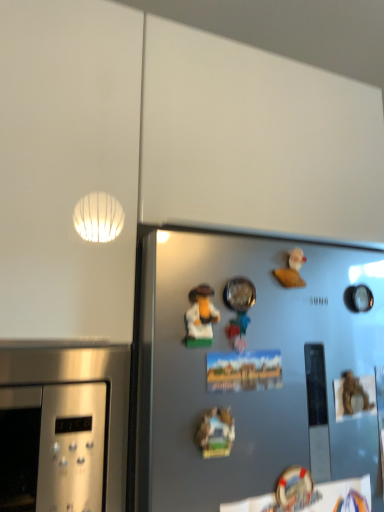
Question: Should I look upward or downward to see white matte rubber duck at upper right, which appears as the 2th toy when viewed from the left?

Choices:
 (A) down
 (B) up

Answer: (A)

Question: Which direction should I rotate to look at metallic silver bowl at center, the first toy when ordered from left to right?

Choices:
 (A) right
 (B) left

Answer: (A)

Question: Is the position of wooden miniature house at center, which is the 2th art from top to bottom, more distant than that of white matte rubber duck at upper right, the first toy viewed from the back?

Choices:
 (A) yes
 (B) no

Answer: (B)

Question: Does wooden miniature house at center, the 1th art ordered from the bottom, have a larger size compared to white matte rubber duck at upper right, positioned as the first toy in right-to-left order?

Choices:
 (A) yes
 (B) no

Answer: (A)

Question: Can you confirm if wooden miniature house at center, which is the 2th art from top to bottom, is positioned to the left of white matte rubber duck at upper right, positioned as the first toy in right-to-left order?

Choices:
 (A) yes
 (B) no

Answer: (A)

Question: Is wooden miniature house at center, which is the 2th art from top to bottom, wider than white matte rubber duck at upper right, the first toy viewed from the back?

Choices:
 (A) no
 (B) yes

Answer: (B)

Question: From the image's perspective, does wooden miniature house at center, the 1th art ordered from the bottom, appear higher than white matte rubber duck at upper right, positioned as the first toy in right-to-left order?

Choices:
 (A) no
 (B) yes

Answer: (A)

Question: From a real-world perspective, does wooden miniature house at center, which is the 2th art from top to bottom, sit lower than white matte rubber duck at upper right, which appears as the 2th toy when viewed from the left?

Choices:
 (A) no
 (B) yes

Answer: (B)

Question: Can you confirm if metallic silver bowl at center, the second toy in the right-to-left sequence, is positioned to the right of white matte rubber duck at upper right, which appears as the 2th toy when viewed from the left?

Choices:
 (A) no
 (B) yes

Answer: (A)

Question: From a real-world perspective, is metallic silver bowl at center, the 2th toy when ordered from back to front, under white matte rubber duck at upper right, placed as the 2th toy when sorted from front to back?

Choices:
 (A) yes
 (B) no

Answer: (A)

Question: Considering the relative sizes of metallic silver bowl at center, the 2th toy when ordered from back to front, and white matte rubber duck at upper right, placed as the 2th toy when sorted from front to back, in the image provided, is metallic silver bowl at center, the 2th toy when ordered from back to front, bigger than white matte rubber duck at upper right, placed as the 2th toy when sorted from front to back,?

Choices:
 (A) yes
 (B) no

Answer: (A)

Question: Is white matte rubber duck at upper right, positioned as the first toy in right-to-left order, at the back of metallic silver bowl at center, the first toy when ordered from left to right?

Choices:
 (A) no
 (B) yes

Answer: (A)

Question: Can you see metallic silver bowl at center, the first toy positioned from the front, touching white matte rubber duck at upper right, positioned as the first toy in right-to-left order?

Choices:
 (A) no
 (B) yes

Answer: (B)

Question: Could you tell me if metallic silver bowl at center, the 2th toy when ordered from back to front, is turned towards white matte rubber duck at upper right, positioned as the first toy in right-to-left order?

Choices:
 (A) yes
 (B) no

Answer: (B)

Question: Does wooden miniature house at center, the 1th art ordered from the bottom, have a lesser width compared to matte plastic toy at center, marked as the first art in a top-to-bottom arrangement?

Choices:
 (A) no
 (B) yes

Answer: (A)